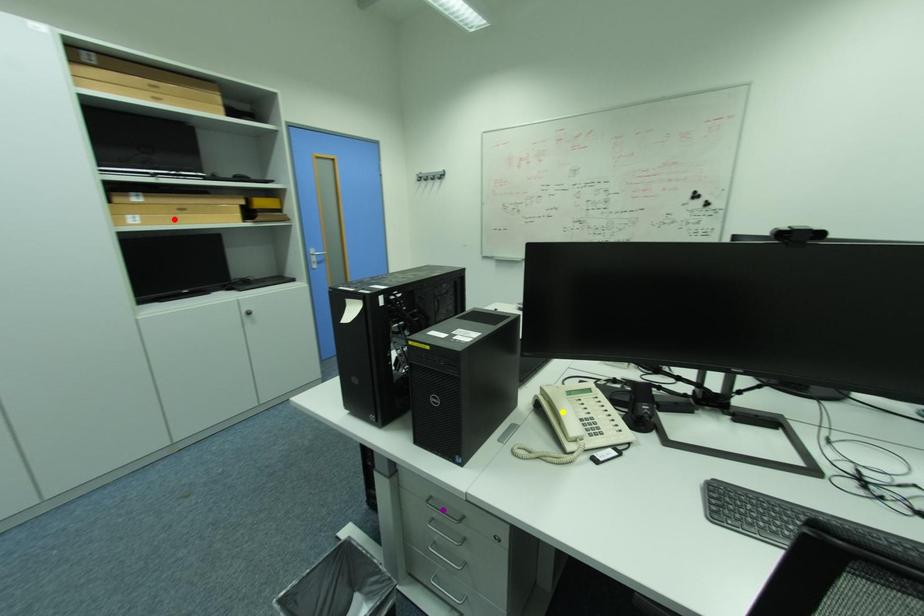
Looking at this image, order these from nearest to farthest:
yellow point
red point
purple point

purple point → yellow point → red point